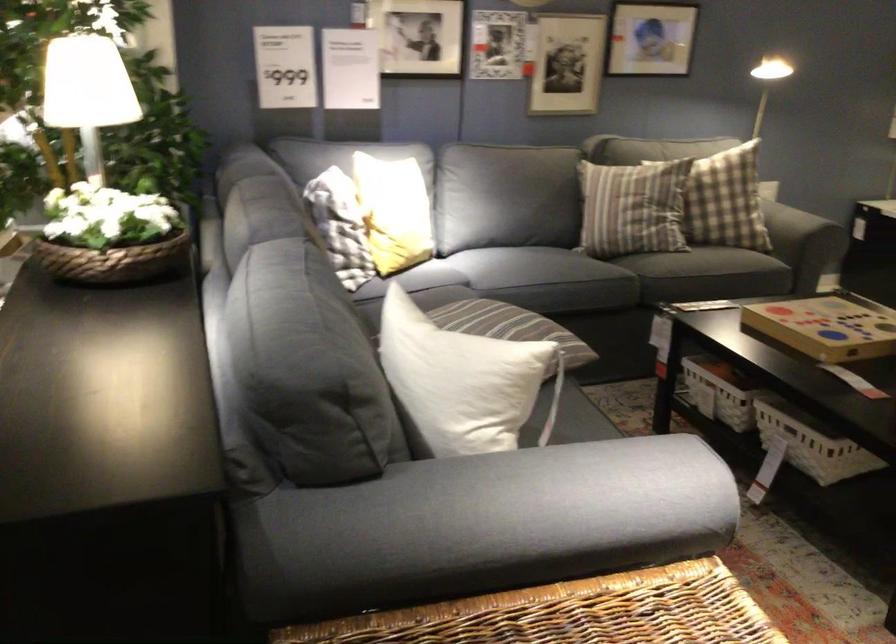
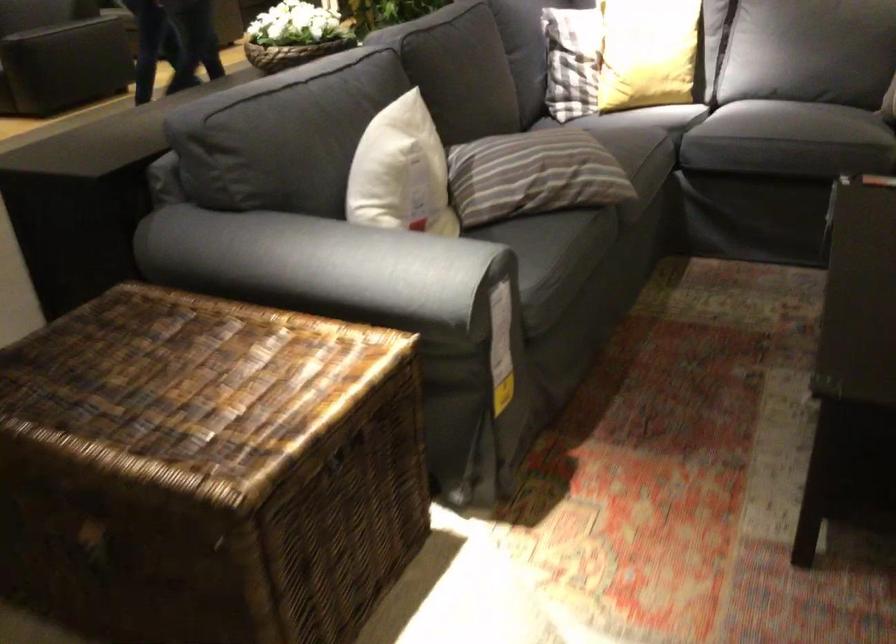
In the second image, find the point that corresponds to point 385,232 in the first image.

(572, 61)